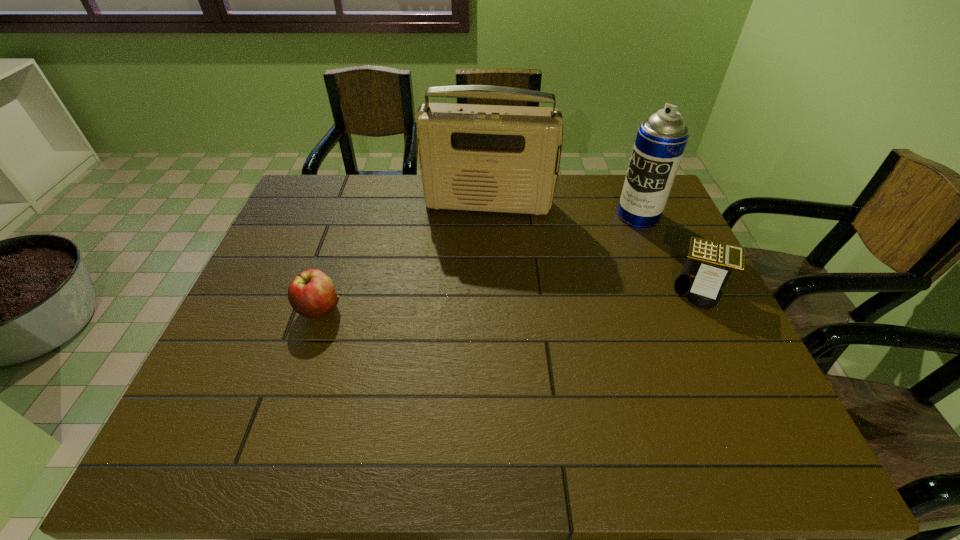
Image resolution: width=960 pixels, height=540 pixels. Identify the location of free space located on the front-facing side of the radio receiver. (474, 284).

What are the coordinates of `vacant space located 0.300m on the front-facing side of the radio receiver` in the screenshot? It's located at (473, 289).

Find the location of a particular element. The width and height of the screenshot is (960, 540). aerosol can that is at the far edge is located at coordinates (661, 140).

This screenshot has width=960, height=540. Find the location of `radio receiver positioned at the far edge`. radio receiver positioned at the far edge is located at coordinates (493, 158).

Locate an element on the screen. The width and height of the screenshot is (960, 540). object present at the left edge is located at coordinates (311, 293).

The width and height of the screenshot is (960, 540). What are the coordinates of `calculator that is at the right edge` in the screenshot? It's located at (709, 264).

The height and width of the screenshot is (540, 960). Identify the location of aerosol can that is at the right edge. (661, 140).

The image size is (960, 540). I want to click on object present at the far right corner, so click(661, 140).

The image size is (960, 540). Find the location of `vacant space at the far edge of the desktop`. vacant space at the far edge of the desktop is located at coordinates (365, 181).

In the image, there is a desktop. At what (x,y) coordinates should I click in order to perform the action: click on vacant space at the near edge. Please return your answer as a coordinate pair (x, y). The height and width of the screenshot is (540, 960). Looking at the image, I should click on (370, 403).